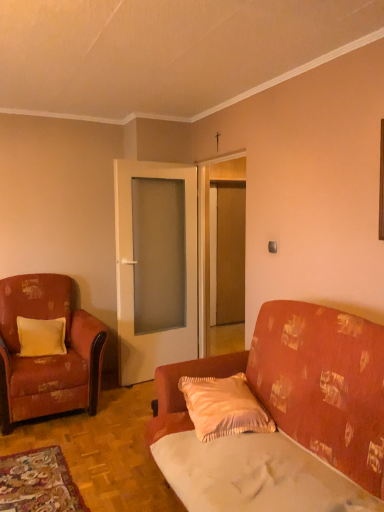
Question: Is pink satin pillow at center, the first pillow viewed from the right, in front of or behind white fabric sheet at lower right in the image?

Choices:
 (A) front
 (B) behind

Answer: (B)

Question: In terms of size, does pink satin pillow at center, the 2th pillow in the back-to-front sequence, appear bigger or smaller than white fabric sheet at lower right?

Choices:
 (A) small
 (B) big

Answer: (A)

Question: Which object is the farthest from the patterned fabric couch at center?

Choices:
 (A) white fabric sheet at lower right
 (B) pink satin pillow at center, which ranks as the second pillow in left-to-right order
 (C) matte glass door at center, which is counted as the second door, starting from the left
 (D) white glass door at center, positioned as the 1th door in left-to-right order
 (E) distressed fabric armchair at left

Answer: (C)

Question: Estimate the real-world distances between objects in this image. Which object is closer to the white glass door at center, arranged as the 2th door when viewed from the right?

Choices:
 (A) pink satin pillow at center, which ranks as the first pillow in front-to-back order
 (B) matte glass door at center, which is counted as the second door, starting from the left
 (C) yellow satin pillow at left, which ranks as the 2th pillow in right-to-left order
 (D) patterned fabric couch at center
 (E) distressed fabric armchair at left

Answer: (B)